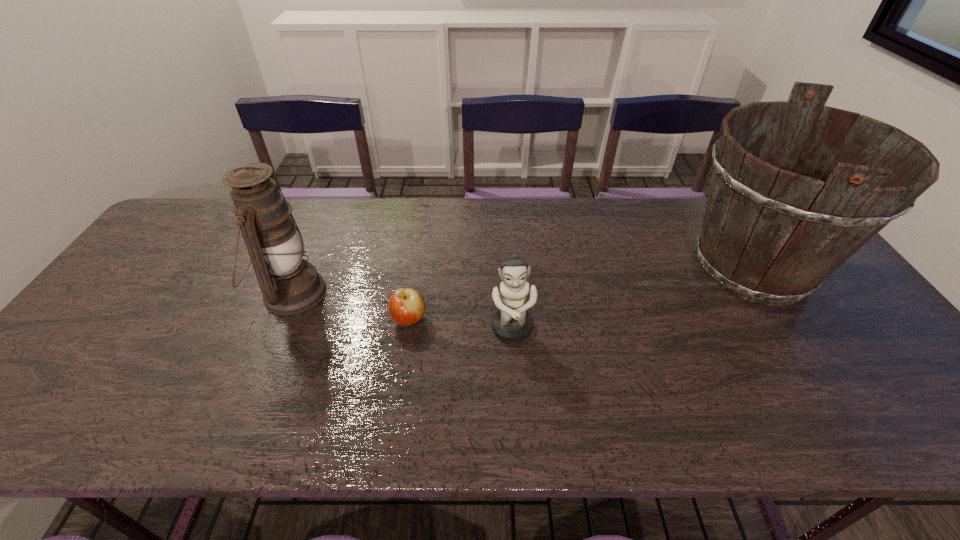
Locate an element on the screen. The height and width of the screenshot is (540, 960). free space between the third object from right to left and the leftmost object is located at coordinates (350, 306).

Find the location of `free space between the apple and the figurine`. free space between the apple and the figurine is located at coordinates (461, 325).

Find the location of a particular element. The image size is (960, 540). free point between the bucket and the figurine is located at coordinates (632, 299).

The image size is (960, 540). I want to click on blank region between the shortest object and the third object from left to right, so click(461, 325).

Find the location of a particular element. Image resolution: width=960 pixels, height=540 pixels. vacant region between the rightmost object and the second object from right to left is located at coordinates (632, 299).

Where is `the third closest object relative to the bucket`? This screenshot has height=540, width=960. the third closest object relative to the bucket is located at coordinates (289, 284).

Identify which object is the third nearest to the figurine. Please provide its 2D coordinates. Your answer should be formatted as a tuple, i.e. [(x, y)], where the tuple contains the x and y coordinates of a point satisfying the conditions above.

[(289, 284)]

Identify the location of free location that satisfies the following two spatial constraints: 1. on the back side of the rightmost object; 2. on the left side of the third shortest object. (302, 267).